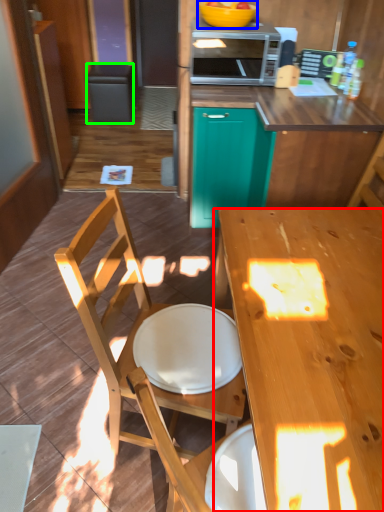
Question: Estimate the real-world distances between objects in this image. Which object is farther from desk (highlighted by a red box), bowl (highlighted by a blue box) or trash bin/can (highlighted by a green box)?

Choices:
 (A) bowl
 (B) trash bin/can

Answer: (B)